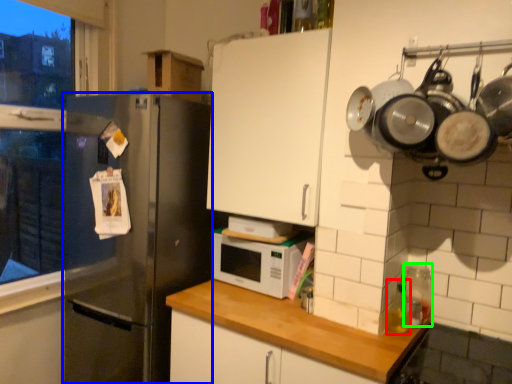
Question: Which object is positioned closest to bottle (highlighted by a red box)? Select from refrigerator (highlighted by a blue box) and appliance (highlighted by a green box).

Choices:
 (A) refrigerator
 (B) appliance

Answer: (B)